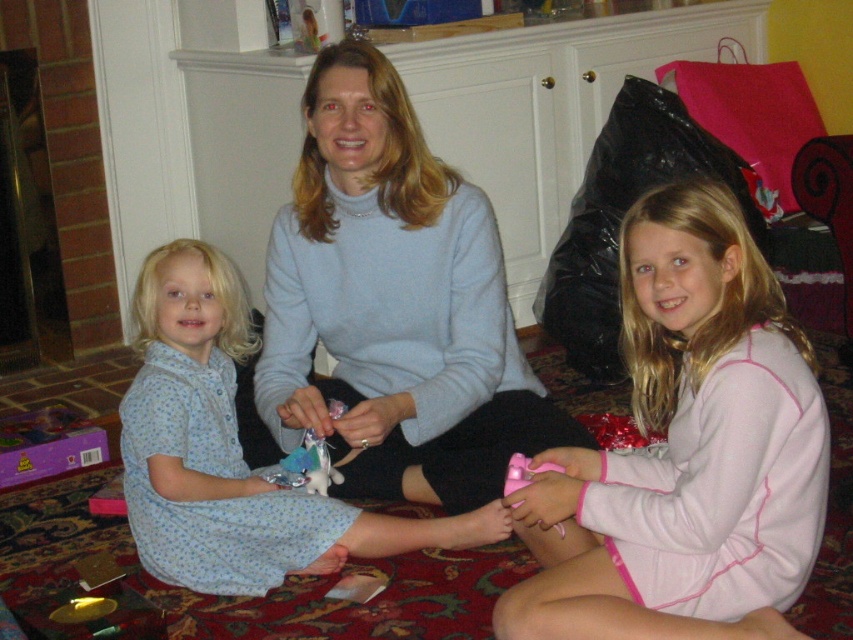
Does pink fleece pajamas at lower right come in front of light blue sweater at center?

Yes, pink fleece pajamas at lower right is closer to the viewer.

How far apart are pink fleece pajamas at lower right and light blue sweater at center?

pink fleece pajamas at lower right and light blue sweater at center are 17.64 inches apart from each other.

The height and width of the screenshot is (640, 853). What do you see at coordinates (685, 451) in the screenshot?
I see `pink fleece pajamas at lower right` at bounding box center [685, 451].

You are a GUI agent. You are given a task and a screenshot of the screen. Output one action in this format:
    pyautogui.click(x=<x>, y=<y>)
    Task: Click on the pink fleece pajamas at lower right
    
    Given the screenshot: What is the action you would take?
    pyautogui.click(x=685, y=451)

Is blue floral dress at left taller than shiny metallic toy at center?

Yes, blue floral dress at left is taller than shiny metallic toy at center.

Consider the image. Is blue floral dress at left thinner than shiny metallic toy at center?

In fact, blue floral dress at left might be wider than shiny metallic toy at center.

Image resolution: width=853 pixels, height=640 pixels. In order to click on blue floral dress at left in this screenshot , I will do `click(230, 452)`.

Does point (469, 472) lie behind point (172, 324)?

That is True.

Does light blue sweater at center have a smaller size compared to blue floral dress at left?

No.

Who is more distant from viewer, (x=341, y=138) or (x=292, y=520)?

The point (x=292, y=520) is more distant.

The height and width of the screenshot is (640, 853). Identify the location of light blue sweater at center. (393, 305).